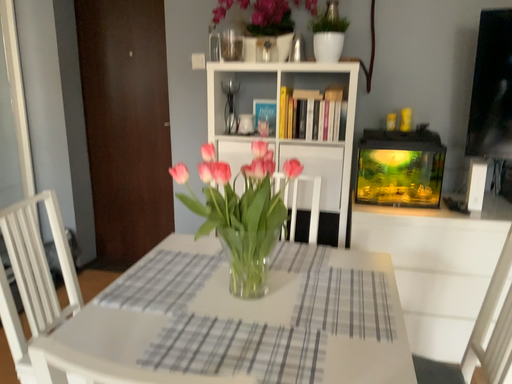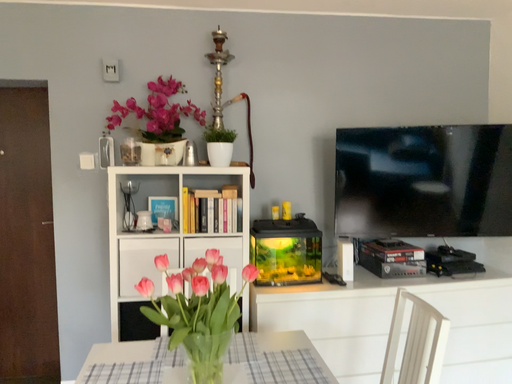
Question: Which way did the camera rotate in the video?

Choices:
 (A) rotated right
 (B) rotated left

Answer: (A)